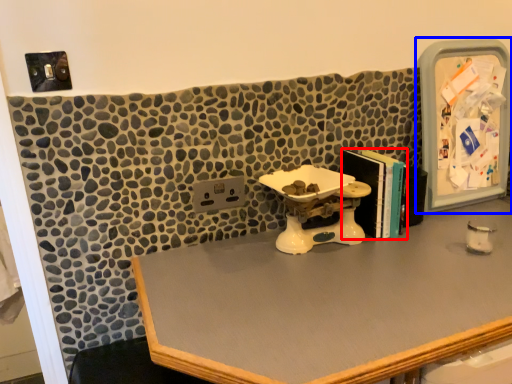
Question: Which object appears farthest to the camera in this image, book (highlighted by a red box) or medicine cabinet (highlighted by a blue box)?

Choices:
 (A) book
 (B) medicine cabinet

Answer: (B)